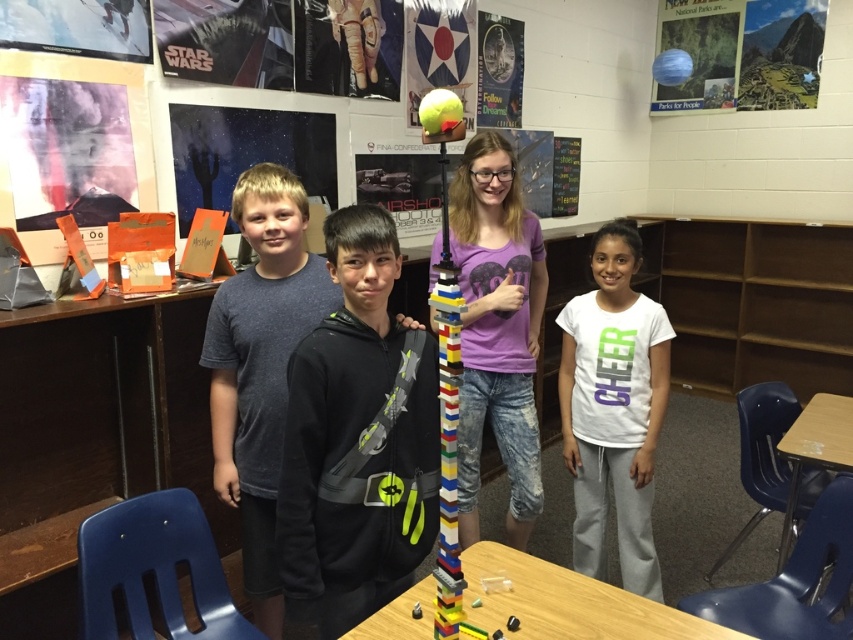
Is point (358, 467) positioned in front of point (267, 589)?

Yes, it is.

Does point (318, 502) come in front of point (236, 209)?

That is True.

Find the location of a particular element. Image resolution: width=853 pixels, height=640 pixels. black fleece hoodie at center is located at coordinates (357, 440).

Is black fleece hoodie at center closer to the viewer compared to purple matte shirt at center?

Yes, black fleece hoodie at center is closer to the viewer.

Can you confirm if black fleece hoodie at center is positioned to the left of purple matte shirt at center?

Yes, black fleece hoodie at center is to the left of purple matte shirt at center.

Locate an element on the screen. The width and height of the screenshot is (853, 640). black fleece hoodie at center is located at coordinates (357, 440).

Find the location of `black fleece hoodie at center`. black fleece hoodie at center is located at coordinates (357, 440).

Who is higher up, purple matte shirt at center or wooden table at lower right?

Positioned higher is purple matte shirt at center.

Does point (531, 321) lie in front of point (845, 419)?

Yes, point (531, 321) is in front of point (845, 419).

Find the location of a particular element. The height and width of the screenshot is (640, 853). purple matte shirt at center is located at coordinates (497, 330).